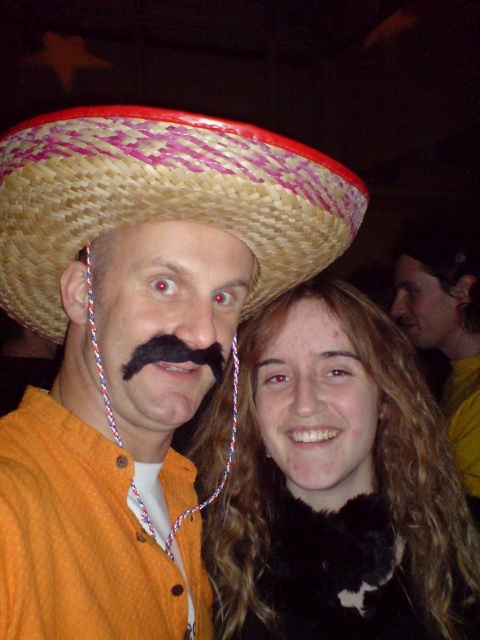
Which is in front, point (243, 428) or point (433, 262)?

Point (243, 428) is more forward.

This screenshot has height=640, width=480. I want to click on black fur coat at center, so click(338, 484).

Is point (222, 502) closer to viewer compared to point (458, 243)?

Yes.

This screenshot has width=480, height=640. I want to click on black fur coat at center, so click(338, 484).

Who is higher up, black fur coat at center or black fuzzy mustache at center?

Positioned higher is black fuzzy mustache at center.

Who is more forward, (398, 390) or (154, 348)?

Positioned in front is point (154, 348).

Find the location of a particular element. The width and height of the screenshot is (480, 640). black fur coat at center is located at coordinates (338, 484).

Does woven straw sombrero at upper center have a larger size compared to black fuzzy mustache at center?

Yes.

Is point (180, 147) less distant than point (165, 349)?

Yes, it is in front of point (165, 349).

Measure the distance between woven straw sombrero at upper center and camera.

woven straw sombrero at upper center is 46.30 centimeters away from camera.

The image size is (480, 640). In order to click on woven straw sombrero at upper center in this screenshot , I will do `click(162, 196)`.